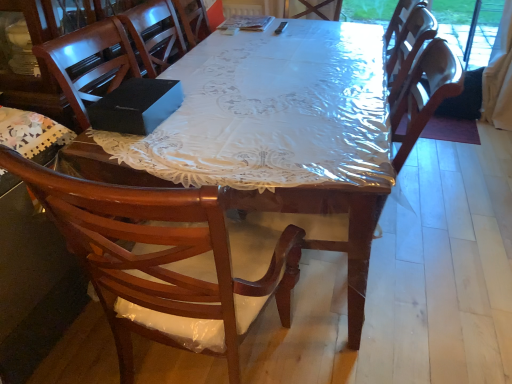
Question: From a real-world perspective, is wooden desk at center positioned above or below wooden armchair at center?

Choices:
 (A) above
 (B) below

Answer: (B)

Question: Relative to wooden armchair at center, is wooden desk at center in front or behind?

Choices:
 (A) front
 (B) behind

Answer: (A)

Question: Choose the correct answer: Is wooden desk at center inside wooden armchair at center or outside it?

Choices:
 (A) outside
 (B) inside

Answer: (A)

Question: From a real-world perspective, is wooden armchair at center above or below wooden desk at center?

Choices:
 (A) above
 (B) below

Answer: (A)

Question: Is wooden armchair at center to the left or to the right of wooden desk at center in the image?

Choices:
 (A) left
 (B) right

Answer: (A)

Question: Considering the positions of wooden armchair at center and wooden desk at center in the image, is wooden armchair at center bigger or smaller than wooden desk at center?

Choices:
 (A) big
 (B) small

Answer: (B)

Question: Considering the positions of wooden armchair at center and wooden desk at center in the image, is wooden armchair at center taller or shorter than wooden desk at center?

Choices:
 (A) tall
 (B) short

Answer: (A)